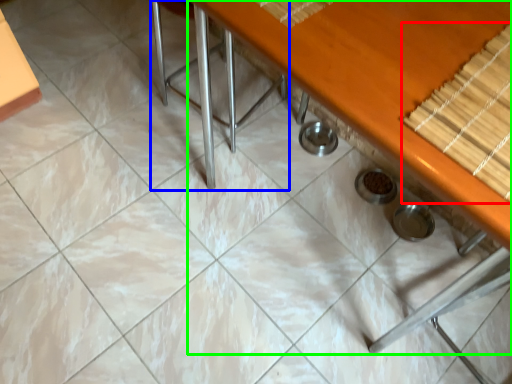
Question: Which object is the farthest from wood (highlighted by a red box)? Choose among these: chair (highlighted by a blue box) or table (highlighted by a green box).

Choices:
 (A) chair
 (B) table

Answer: (A)